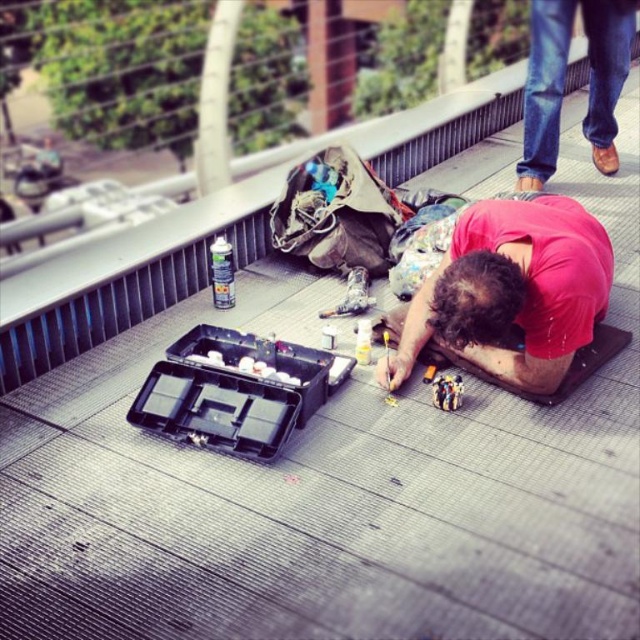
You are a security guard on the rooftop and need to locate the red matte shirt at center and the brown leather shoes at upper right. Based on their positions, which object is closer to the edge of the rooftop?

The red matte shirt at center is closer to the edge of the rooftop because it is positioned in front of the brown leather shoes at upper right, indicating it is nearer to the viewer and thus likely closer to the edge.

You are a safety inspector checking the rooftop. You notice a point at coordinates [509,292]. What object is located there?

The point at coordinates [509,292] indicates the red matte shirt at center.

You are a fashion designer observing a person on a rooftop. You notice the red matte shirt at center and the brown leather shoes at upper right. Which item has a greater width?

The red matte shirt at center has a greater width than the brown leather shoes at upper right.